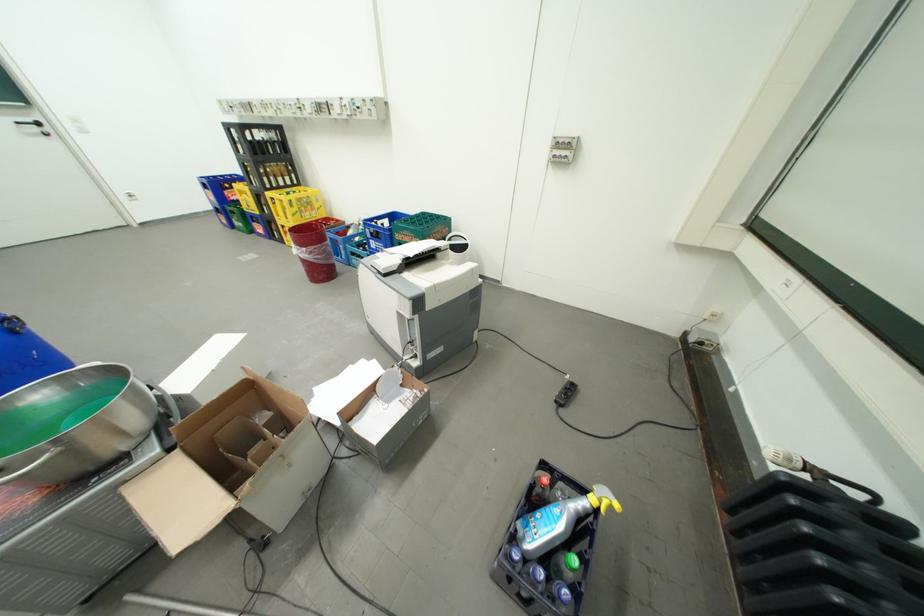
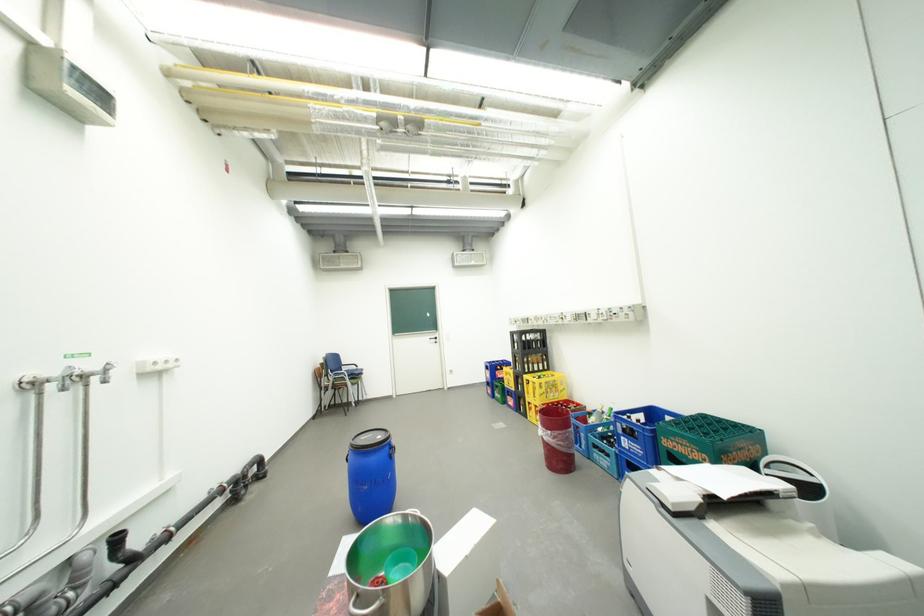
How did the camera likely rotate?

The camera rotated toward left-up.